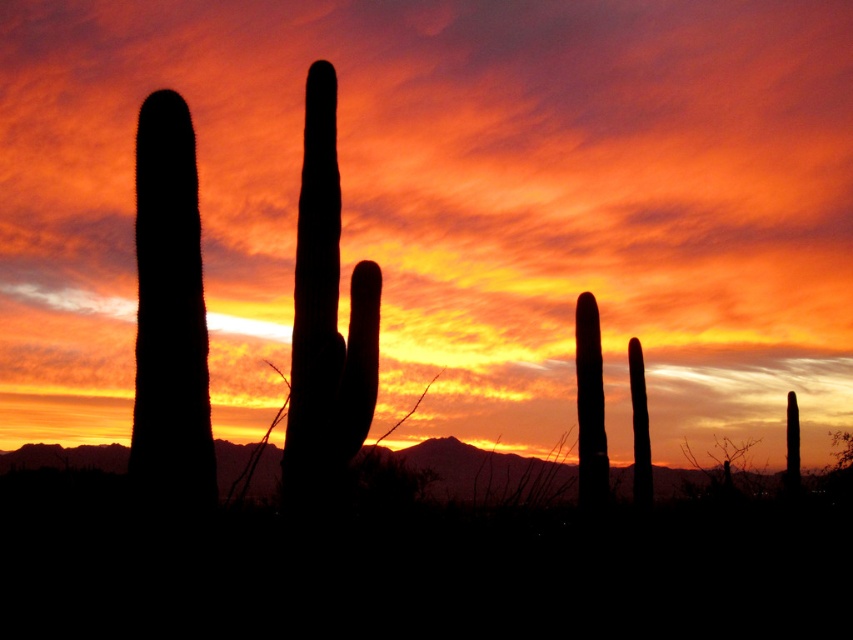
Question: Does black matte cactus at left appear over silhouette cactus at right?

Choices:
 (A) yes
 (B) no

Answer: (A)

Question: Is silhouette cactus at center thinner than silhouette cactus at right?

Choices:
 (A) no
 (B) yes

Answer: (A)

Question: Among these points, which one is nearest to the camera?

Choices:
 (A) (187, 273)
 (B) (309, 124)
 (C) (585, 490)

Answer: (A)

Question: Is silhouette cactus at center to the right of silhouette cactus at right from the viewer's perspective?

Choices:
 (A) no
 (B) yes

Answer: (A)

Question: Which object appears closest to the camera in this image?

Choices:
 (A) silhouette cactus at right
 (B) black matte cactus at left
 (C) silhouette cactus at center

Answer: (B)

Question: Which of the following is the farthest from the observer?

Choices:
 (A) silhouette cactus at right
 (B) silhouette cactus at center

Answer: (A)